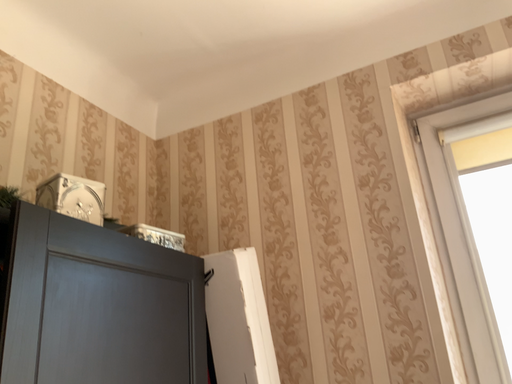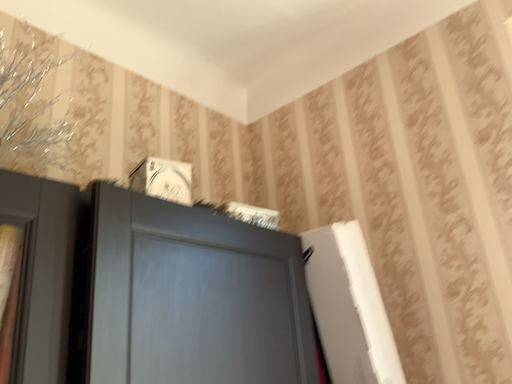
Question: How did the camera likely rotate when shooting the video?

Choices:
 (A) rotated right
 (B) rotated left

Answer: (B)